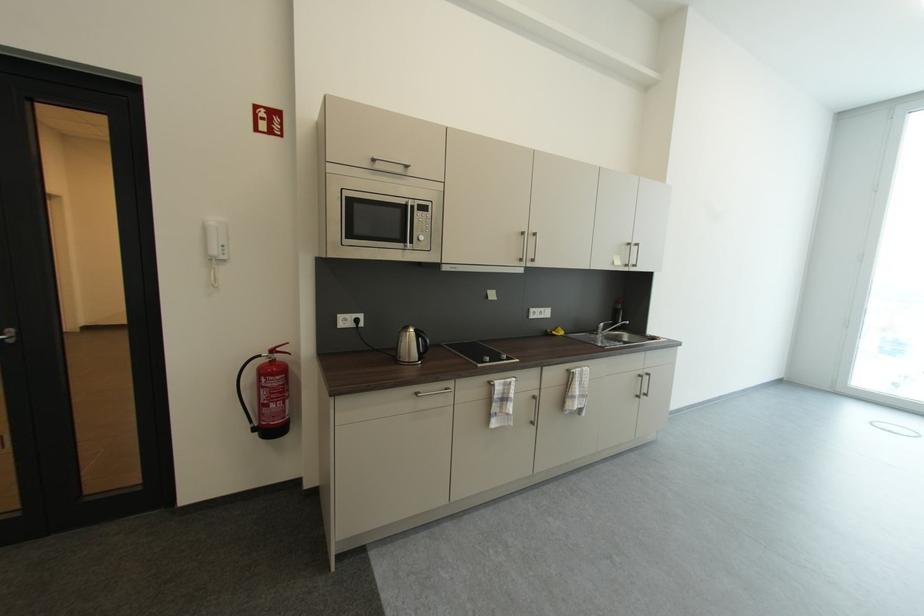
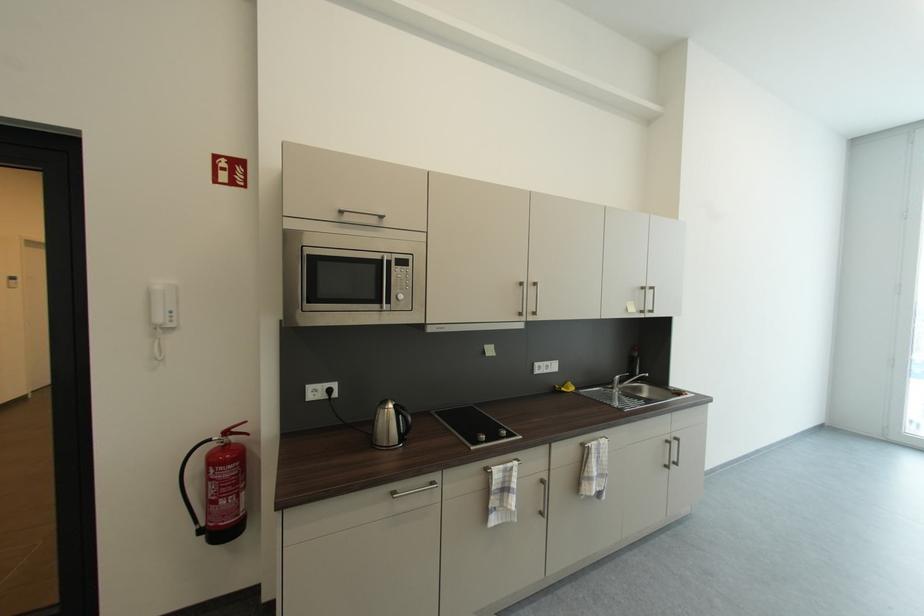
Locate, in the second image, the point that corresponds to (428,222) in the first image.

(407, 278)